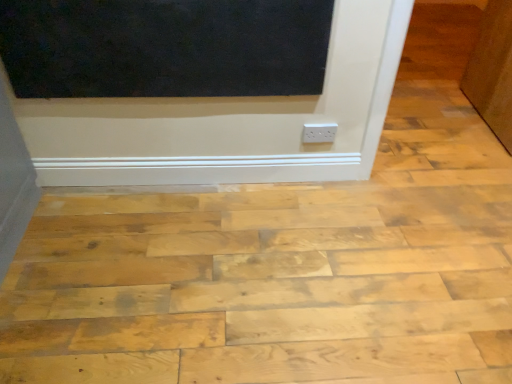
Where is `free location in front of brown matte door at upper right`? The width and height of the screenshot is (512, 384). free location in front of brown matte door at upper right is located at coordinates (463, 148).